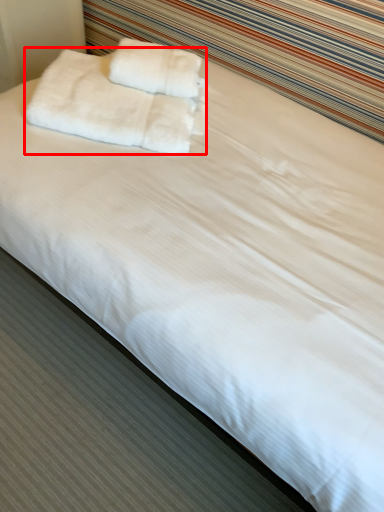
Question: Where is towel (annotated by the red box) located in relation to towel in the image?

Choices:
 (A) left
 (B) right

Answer: (A)